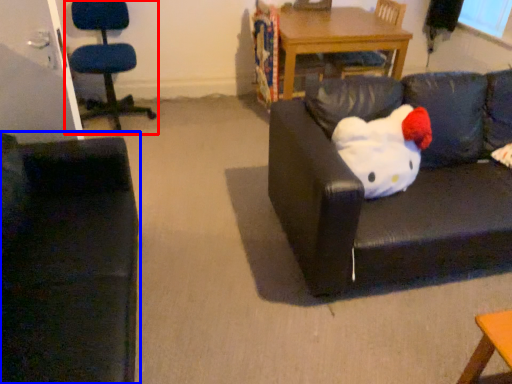
Question: Among these objects, which one is nearest to the camera, chair (highlighted by a red box) or studio couch (highlighted by a blue box)?

Choices:
 (A) chair
 (B) studio couch

Answer: (B)